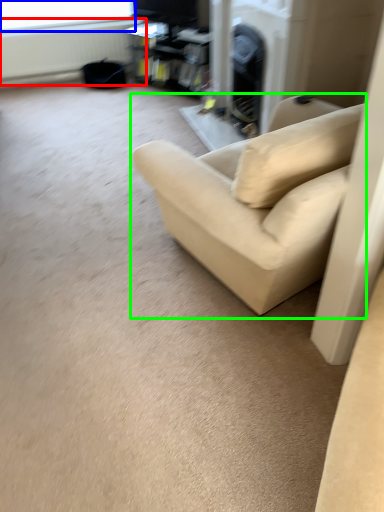
Question: Based on their relative distances, which object is nearer to radiator (highlighted by a red box)? Choose from window screen (highlighted by a blue box) and studio couch (highlighted by a green box).

Choices:
 (A) window screen
 (B) studio couch

Answer: (A)